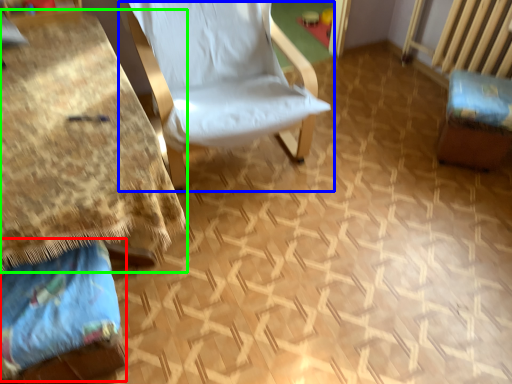
Question: Which object is positioned farthest from fabric (highlighted by a red box)? Select from chair (highlighted by a blue box) and table (highlighted by a green box).

Choices:
 (A) chair
 (B) table

Answer: (A)